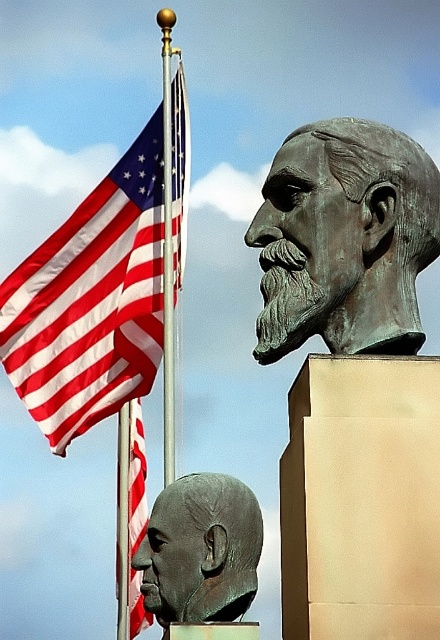
Question: Can you confirm if red-white striped fabric at left is thinner than bronze statue at upper center?

Choices:
 (A) yes
 (B) no

Answer: (B)

Question: Can you confirm if bronze statue at upper center is bigger than bronze head at center?

Choices:
 (A) no
 (B) yes

Answer: (A)

Question: Which point is farther to the camera?

Choices:
 (A) (413, 186)
 (B) (94, 296)
 (C) (257, 524)

Answer: (B)

Question: Which of the following is the farthest from the observer?

Choices:
 (A) bronze head at center
 (B) bronze statue at upper center

Answer: (A)

Question: Estimate the real-world distances between objects in this image. Which object is closer to the bronze head at center?

Choices:
 (A) red-white striped fabric at left
 (B) bronze statue at upper center

Answer: (B)

Question: Does red-white striped fabric at left appear over bronze statue at upper center?

Choices:
 (A) no
 (B) yes

Answer: (B)